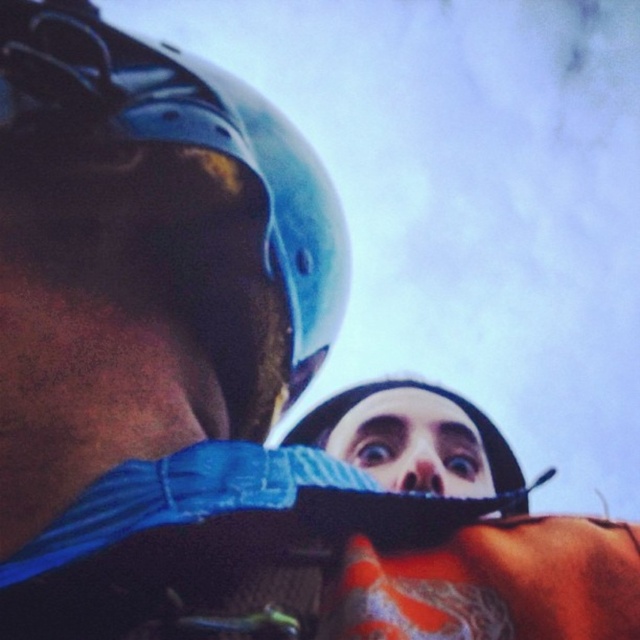
You are a photographer trying to capture a closeup shot of the blue matte helmet at upper left and the smooth skin face at center. Since the background is blurred, you need to ensure both subjects are in focus. Given their sizes, which subject should you adjust your focus on first to ensure clarity?

The blue matte helmet at upper left has a larger size compared to the smooth skin face at center, so you should focus on the blue matte helmet at upper left first to ensure clarity since it occupies more space in the frame.

You are a photographer analyzing this image from below two helmeted individuals. You notice two points marked at coordinates point (122, 33) and point (369, 396). Which point is nearer to your camera position?

Point (122, 33) is closer to the camera than point (369, 396).

You are a photographer trying to capture a closeup of the blue matte helmet at upper left. Based on its 2D coordinates, where should you position your camera relative to the center of the image to ensure it is centered in your viewfinder?

The blue matte helmet at upper left is located at coordinates point (195, 186). To center it in the viewfinder, position the camera so the center aligns with those coordinates.